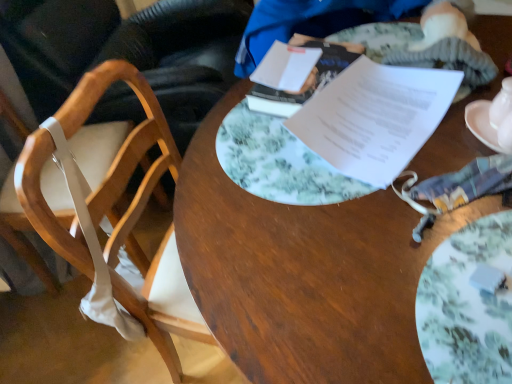
The image size is (512, 384). I want to click on vacant space behind white glossy teapot at upper right, so click(458, 93).